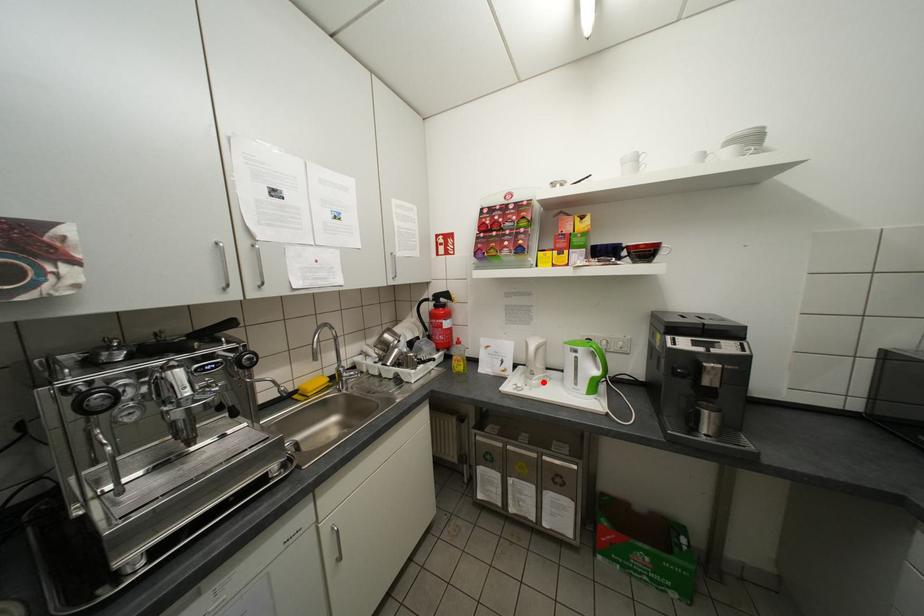
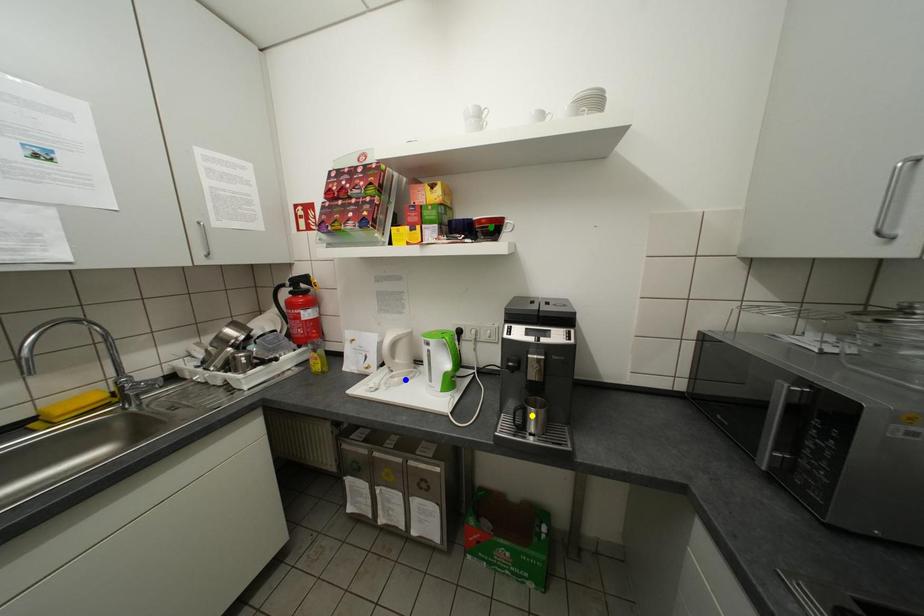
Question: I am providing you with two images of the same scene from different viewpoints. A red point is marked on the first image. You are given multiple points on the second image. Which spot in image 2 lines up with the point in image 1?

Choices:
 (A) yellow point
 (B) blue point
 (C) green point

Answer: (B)